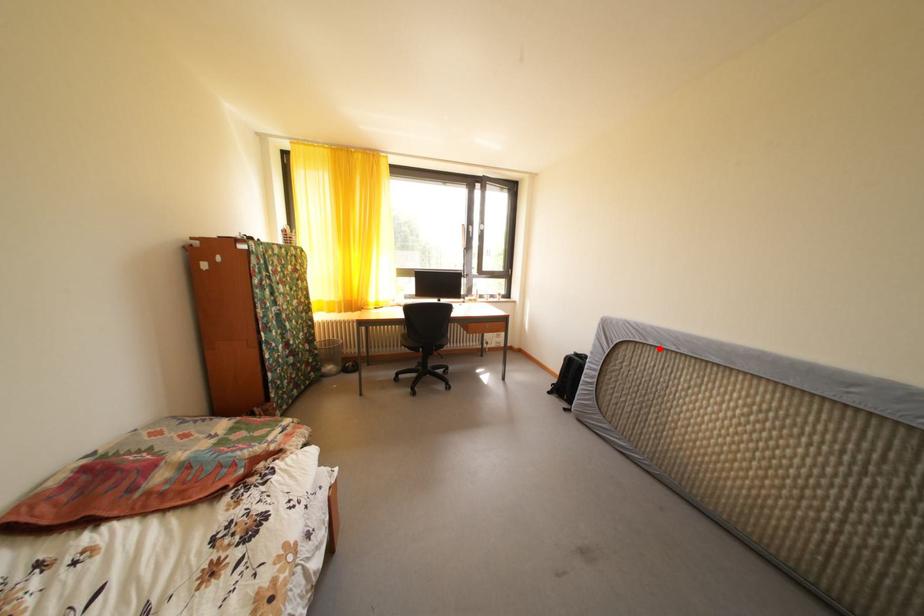
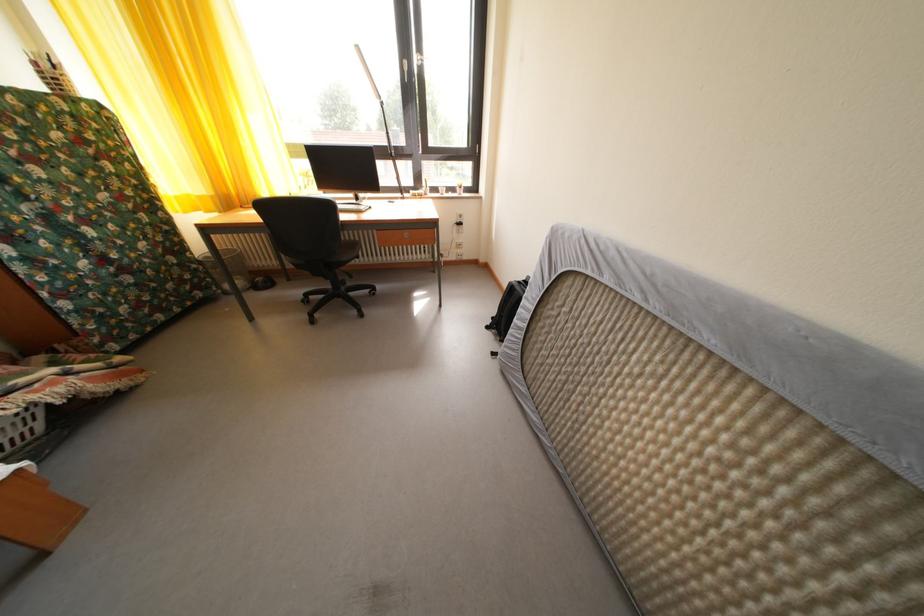
The point at the highlighted location is marked in the first image. Where is the corresponding point in the second image?

(615, 285)